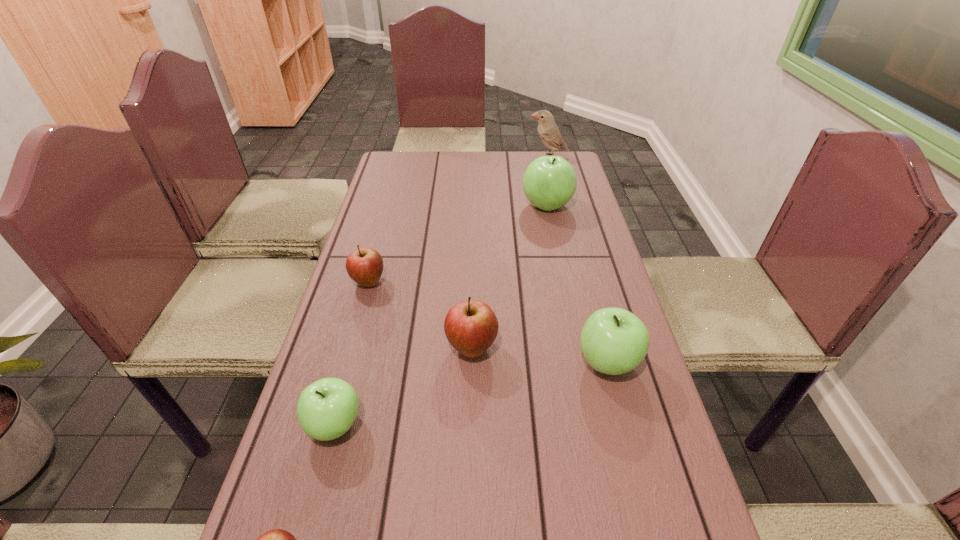
Where is `white bird`? white bird is located at coordinates (549, 133).

In order to click on bird in this screenshot , I will do `click(549, 133)`.

This screenshot has height=540, width=960. I want to click on the sixth nearest object, so click(549, 182).

Where is `the farthest apple`? This screenshot has height=540, width=960. the farthest apple is located at coordinates (549, 182).

The image size is (960, 540). In order to click on the fourth object from right to left in this screenshot , I will do `click(471, 327)`.

Where is `the biggest red apple`? The height and width of the screenshot is (540, 960). the biggest red apple is located at coordinates (471, 327).

Find the location of `the second biggest green apple`. the second biggest green apple is located at coordinates (614, 341).

Image resolution: width=960 pixels, height=540 pixels. What are the coordinates of `the nearest green apple` in the screenshot? It's located at (327, 408).

The width and height of the screenshot is (960, 540). What are the coordinates of `the sixth farthest object` in the screenshot? It's located at (327, 408).

Find the location of `the second smallest red apple`. the second smallest red apple is located at coordinates (365, 265).